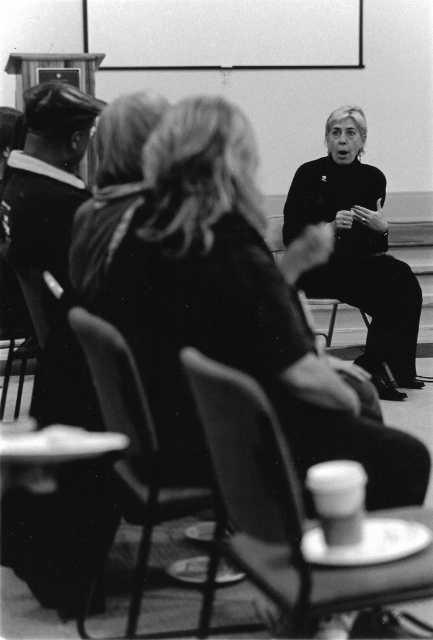
Based on the scene description, where is the black matte turtleneck at center located in the image?

The black matte turtleneck at center is located at point coordinates of [358,250].

You are standing at the entrance of the room and see the point marked at coordinates (277, 508). What object is located at that point?

The point at (277, 508) corresponds to a smooth plastic cup at lower center.

You are standing at the entrance of the room and want to grab the smooth plastic cup at lower center. According to the coordinates provided, in which direction should you move from your current position to reach it?

The smooth plastic cup at lower center is located at point (277,508). Since the coordinate system likely places the origin at the bottom left corner, moving towards the upper right direction from the entrance would lead you to the cup.